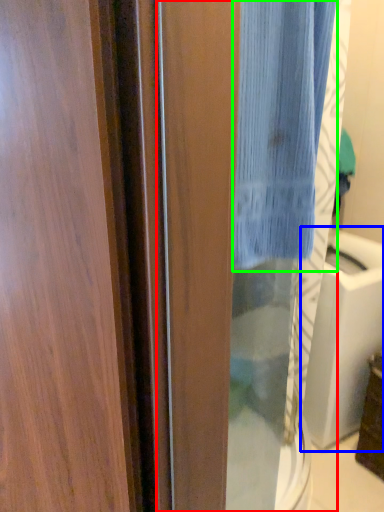
Question: Considering the real-world distances, which object is closest to screen door (highlighted by a red box)? sink (highlighted by a blue box) or curtain (highlighted by a green box).

Choices:
 (A) sink
 (B) curtain

Answer: (A)